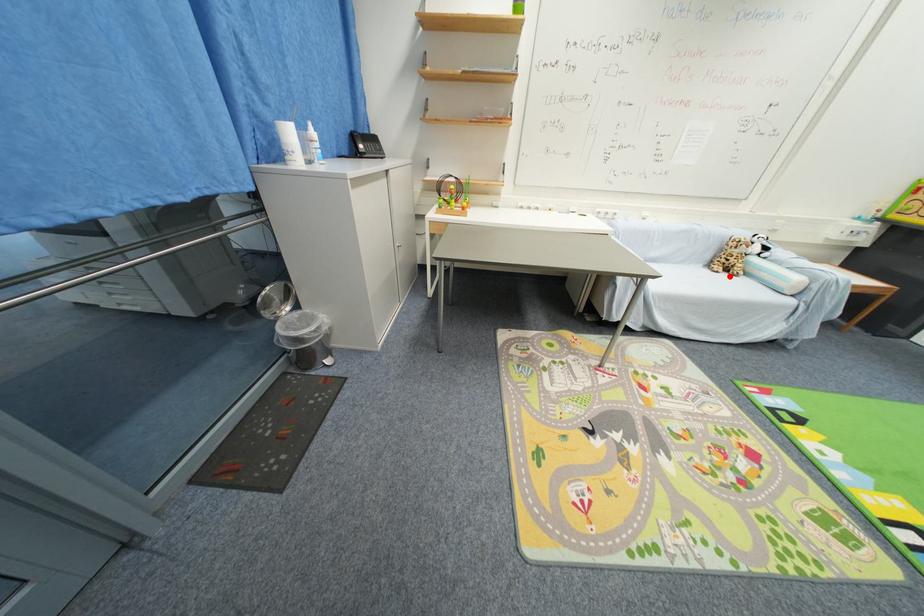
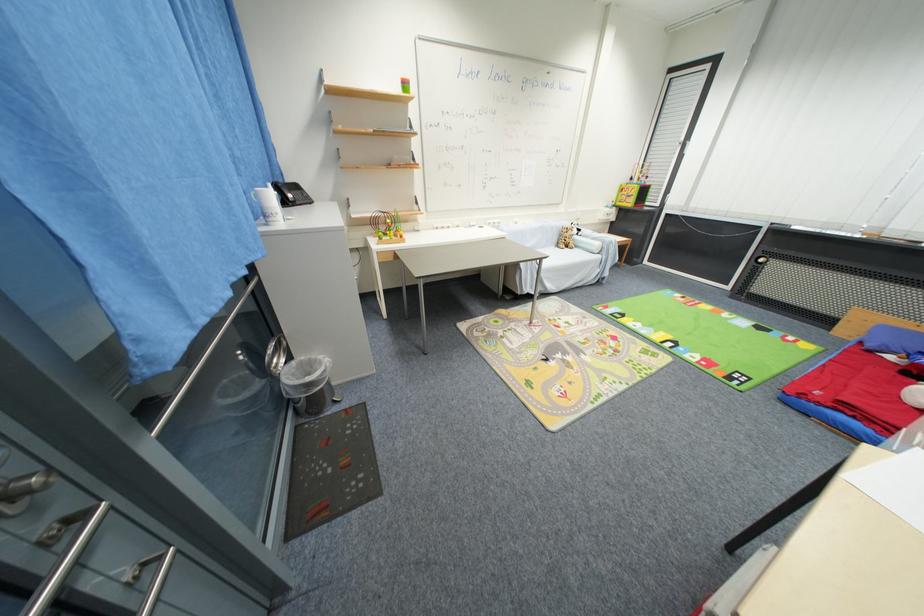
Question: I am providing you with two images of the same scene from different viewpoints. In image1, a red point is highlighted. Considering the same 3D point in image2, which of the following is correct?

Choices:
 (A) It is closer
 (B) It is farther

Answer: (B)